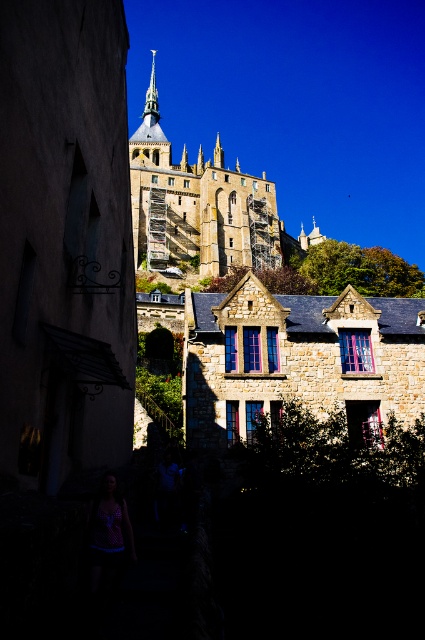
You are a tourist standing at the base of the hill and want to take a photo of the stone medieval castle at upper center. However, there is a stone textured house at center in your way. Can you still see the castle through the house?

Answer: The stone textured house at center is in front of the stone medieval castle at upper center, so the house is blocking the view of the castle. You cannot see the castle through the house.

You are an architect planning to place a new sculpture between the stone textured house at center and the smooth gold spire at upper center. Given that the sculpture requires a space wider than the narrower of the two objects, will it fit between them?

The stone textured house at center is wider than the smooth gold spire at upper center. Therefore, the sculpture requiring space wider than the narrower object can fit between them as the narrower object is the smooth gold spire at upper center, and the space between them should accommodate it.